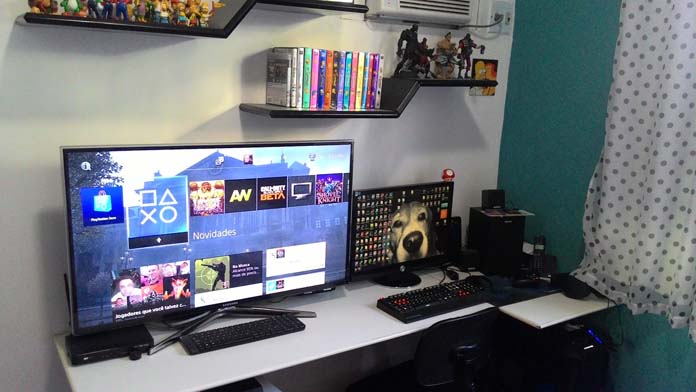
The image size is (696, 392). In order to click on telephone in this screenshot , I will do `click(539, 258)`.